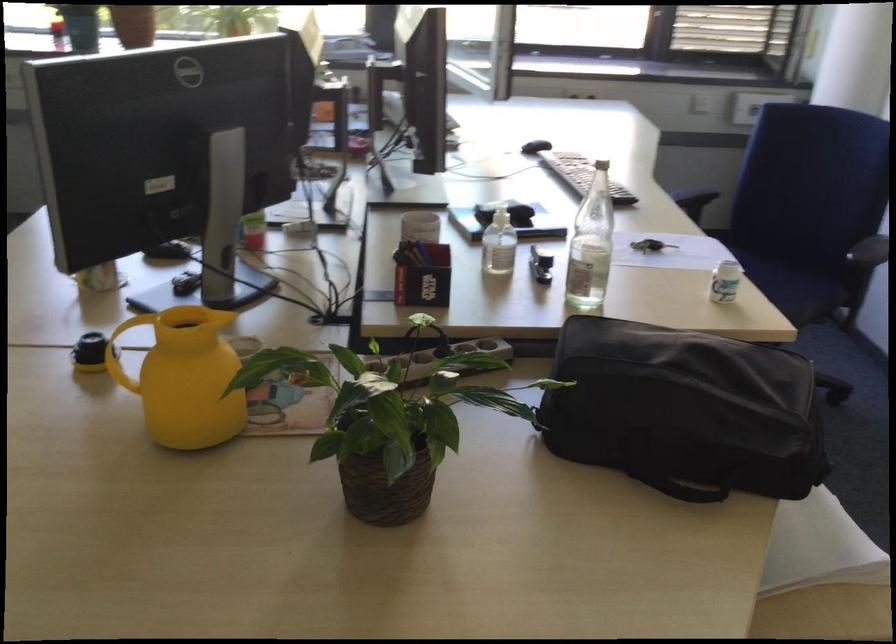
The image size is (896, 644). Find the location of `black stapler`. black stapler is located at coordinates (540, 265).